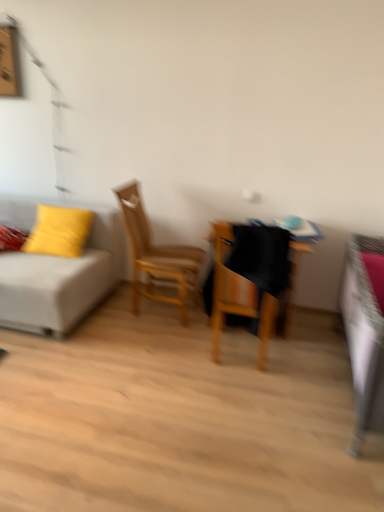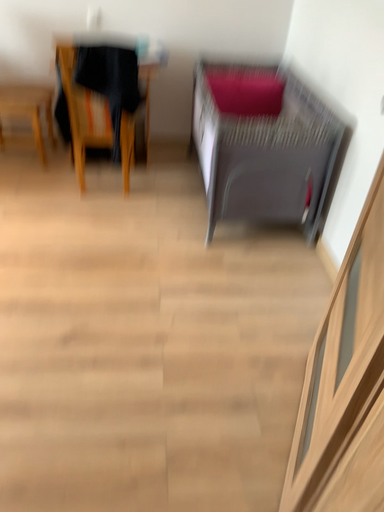
Question: Which way did the camera rotate in the video?

Choices:
 (A) rotated left
 (B) rotated right

Answer: (B)